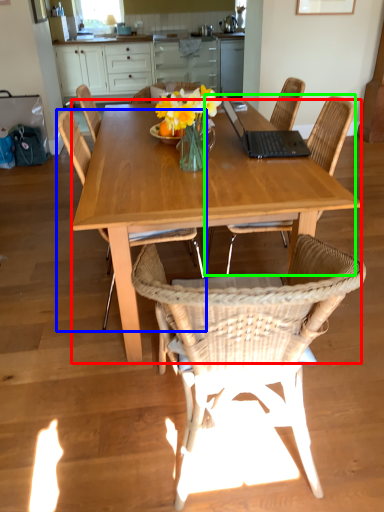
Question: Considering the real-world distances, which object is farthest from kitchen & dining room table (highlighted by a red box)? chair (highlighted by a blue box) or chair (highlighted by a green box)?

Choices:
 (A) chair
 (B) chair

Answer: (B)